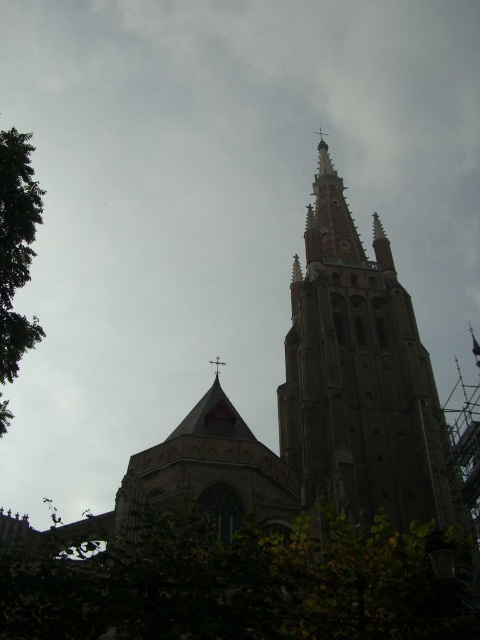
Question: Which of the following is the farthest from the observer?

Choices:
 (A) (313, 547)
 (B) (22, 330)

Answer: (B)

Question: Considering the relative positions of green leafy tree at lower center and green leafy tree at left in the image provided, where is green leafy tree at lower center located with respect to green leafy tree at left?

Choices:
 (A) below
 (B) above

Answer: (A)

Question: From the image, what is the correct spatial relationship of brown stone tower at center in relation to green leafy tree at left?

Choices:
 (A) left
 (B) right

Answer: (B)

Question: Estimate the real-world distances between objects in this image. Which object is closer to the brown stone tower at center?

Choices:
 (A) green leafy tree at left
 (B) green leafy tree at lower center

Answer: (B)

Question: Can you confirm if green leafy tree at lower center is positioned to the right of green leafy tree at left?

Choices:
 (A) yes
 (B) no

Answer: (A)

Question: Among these points, which one is farthest from the camera?

Choices:
 (A) (8, 337)
 (B) (233, 556)
 (C) (288, 433)

Answer: (C)